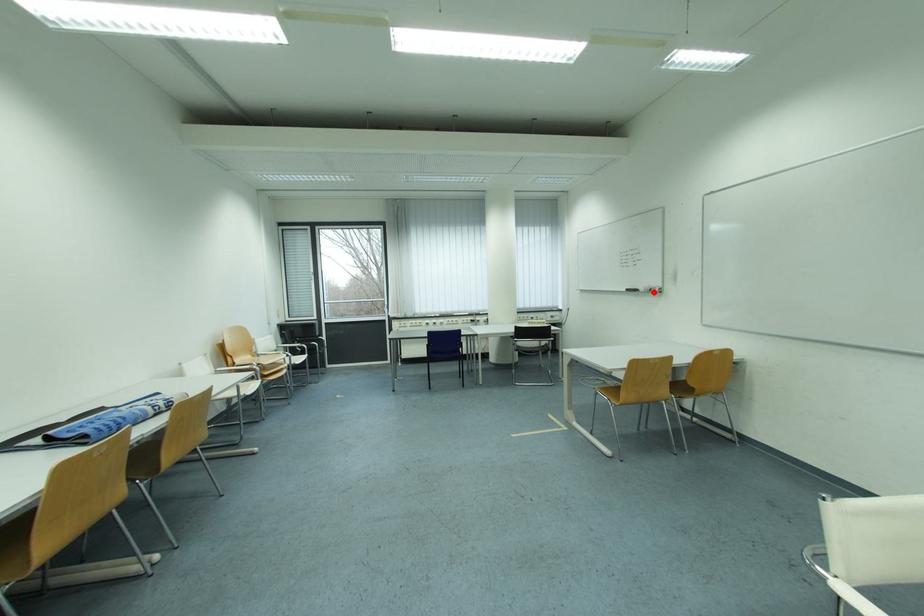
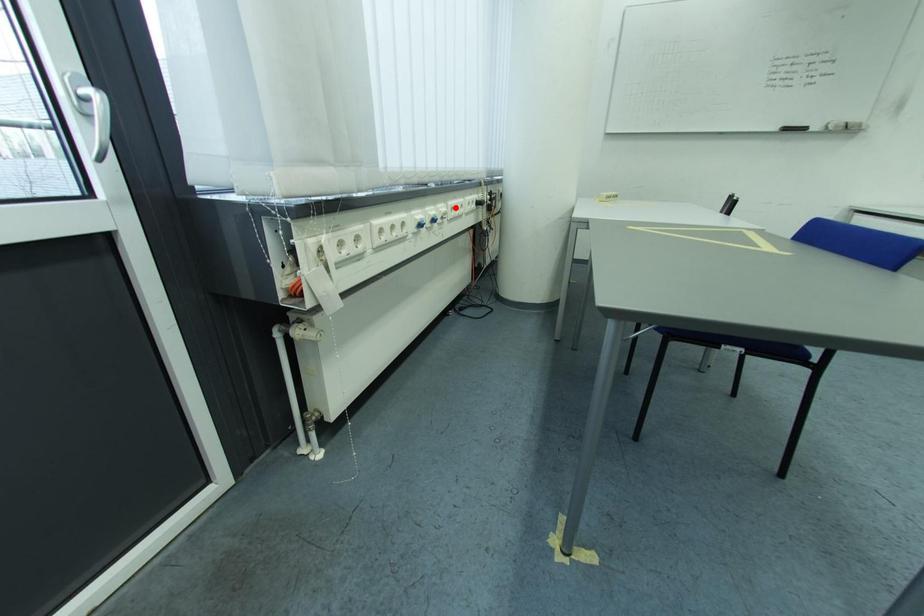
I am providing you with two images of the same scene from different viewpoints. A red point is marked on the first image and another point is marked on the second image. Are the points marked in image1 and image2 representing the same 3D position?

No